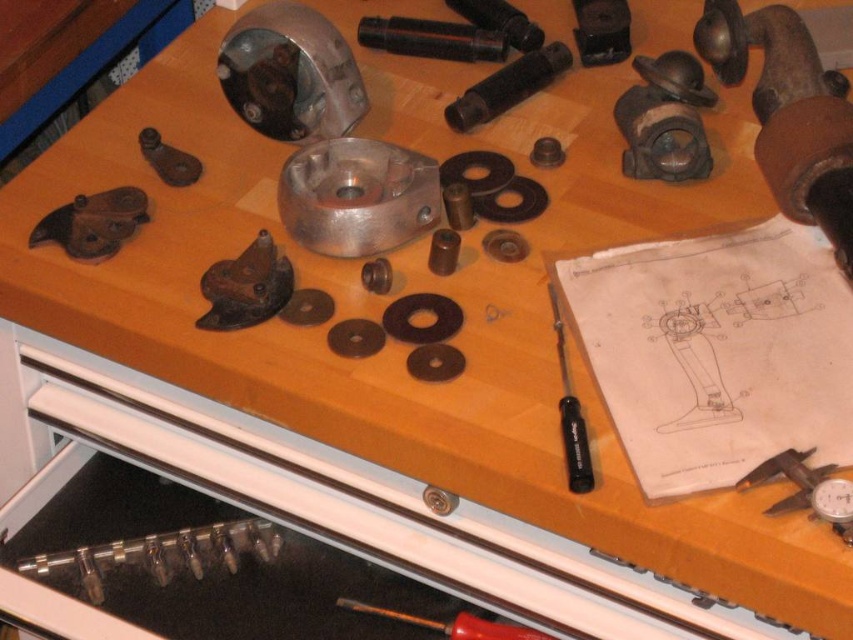
You are standing in front of the workbench and want to reach the point at coordinates point (99, 572). Can you estimate how far this point is from you?

The point (99, 572) is 94.85 centimeters away from the viewer, so you are approximately 95 centimeters away from it.

You are working in a workshop and need to connect the clear plastic tube at lower left to the metallic gauge at lower right. The minimum required distance between them for the connection is 60 centimeters. Can you make the connection as it is currently positioned?

The clear plastic tube at lower left is 59.76 centimeters from the metallic gauge at lower right. Since the required distance is 60 centimeters, the connection cannot be made with the current positioning.

You are an engineer inspecting the workspace. You need to choose between the clear plastic tube at lower left and the metallic gauge at lower right for a project requiring a wider component. Which one should you select?

The clear plastic tube at lower left has a greater width than the metallic gauge at lower right, so you should select the clear plastic tube at lower left for the project.